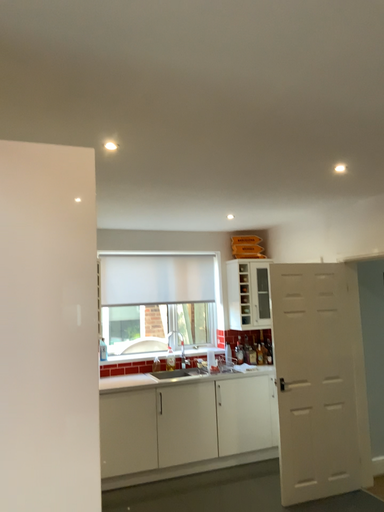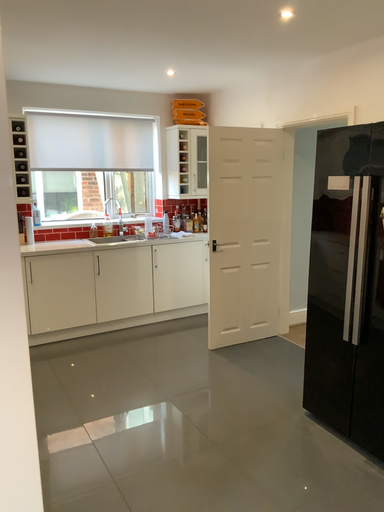
Question: Which way did the camera rotate in the video?

Choices:
 (A) rotated left
 (B) rotated right

Answer: (B)